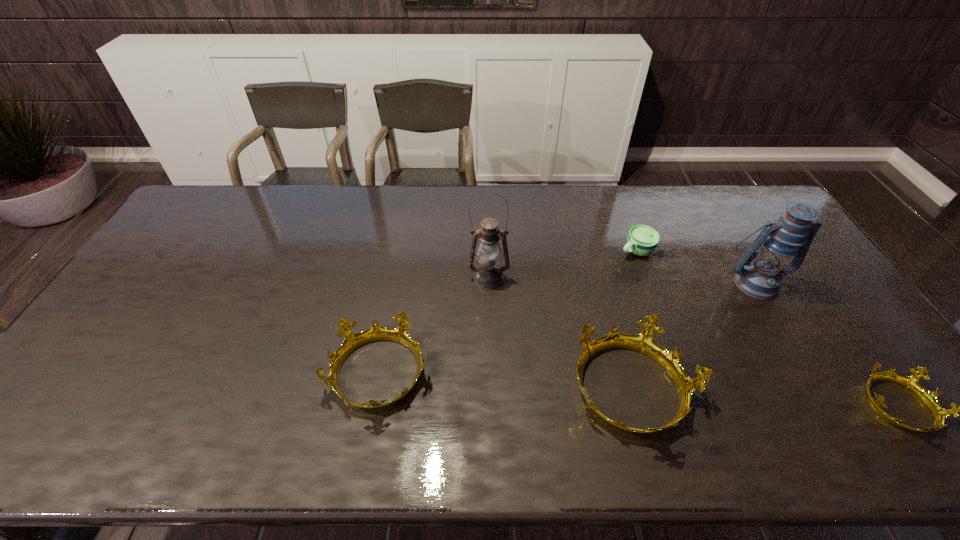
Image resolution: width=960 pixels, height=540 pixels. I want to click on free spot located on the front-facing side of the second tallest object, so click(x=825, y=399).

Where is `object located in the right edge section of the desktop`? Image resolution: width=960 pixels, height=540 pixels. object located in the right edge section of the desktop is located at coordinates (778, 243).

Identify the location of free spot at the far edge of the desktop. (523, 214).

Identify the location of free region at the near edge of the desktop. The image size is (960, 540). (694, 401).

The width and height of the screenshot is (960, 540). Identify the location of blank space at the left edge. 125,368.

In the image, there is a desktop. Where is `vacant space at the right edge`? This screenshot has height=540, width=960. vacant space at the right edge is located at coordinates (804, 279).

Where is `vacant space at the far left corner`? This screenshot has height=540, width=960. vacant space at the far left corner is located at coordinates (201, 206).

In the image, there is a desktop. Where is `vacant space at the far right corner`? vacant space at the far right corner is located at coordinates (757, 222).

Find the location of `free spot between the second crown from left to right and the lantern`. free spot between the second crown from left to right and the lantern is located at coordinates (693, 336).

What are the coordinates of `free space between the oil lamp and the fifth shortest object` in the screenshot? It's located at (622, 280).